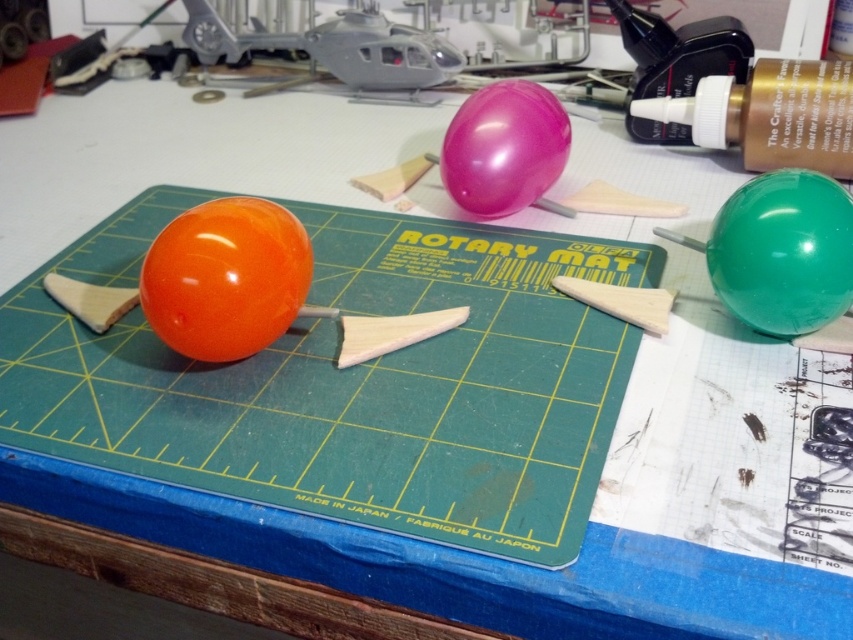
Based on the photo, you are setting up a display for a party and need to know which balloon is shorter. You have a green glossy balloon at right and a glossy rubber balloon at center. Which one is shorter?

The green glossy balloon at right is not as tall as the glossy rubber balloon at center, so the green glossy balloon at right is shorter.

You are an artist working on a sculpture and need to position a new object between the green glossy balloon at right and the glossy rubber balloon at center. Based on their positions, which balloon should the new object be closer to?

The new object should be closer to the glossy rubber balloon at center because the green glossy balloon at right is closer to the viewer, meaning the glossy rubber balloon at center is further back, so placing the new object closer to it would maintain the spatial arrangement.